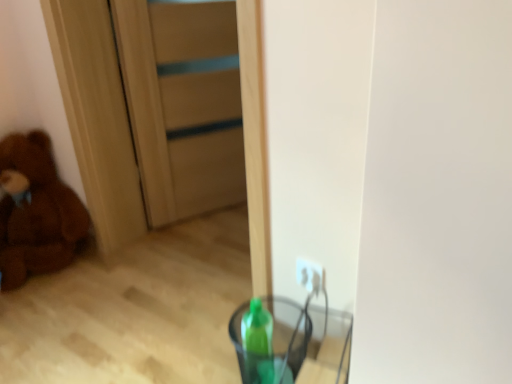
Question: Does point (290, 326) appear closer or farther from the camera than point (31, 135)?

Choices:
 (A) farther
 (B) closer

Answer: (B)

Question: Is transparent plastic cup at lower center situated inside brown plush teddy bear at left or outside?

Choices:
 (A) inside
 (B) outside

Answer: (B)

Question: Estimate the real-world distances between objects in this image. Which object is closer to the brown plush teddy bear at left?

Choices:
 (A) transparent plastic cup at lower center
 (B) wooden door at center

Answer: (B)

Question: Which object is positioned farthest from the transparent plastic cup at lower center?

Choices:
 (A) brown plush teddy bear at left
 (B) wooden door at center

Answer: (A)